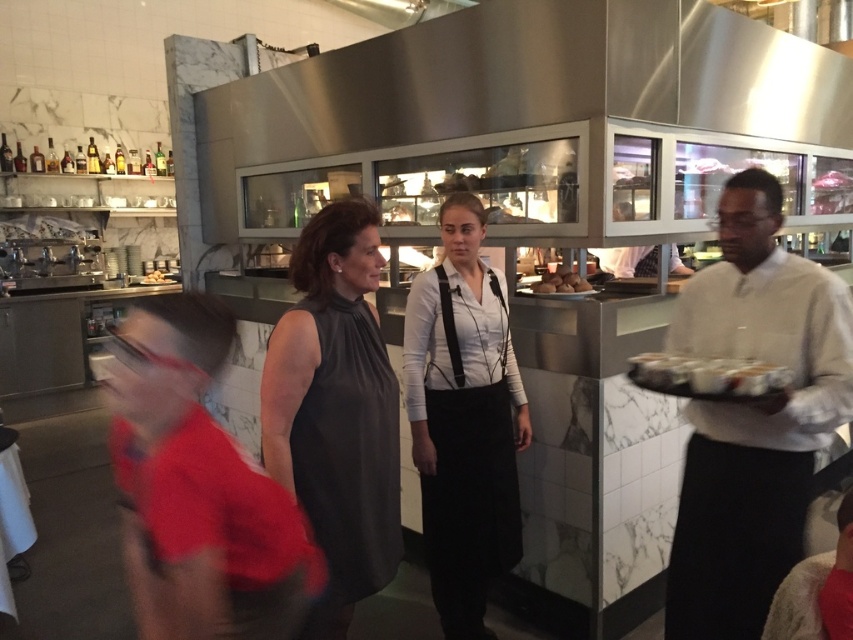
Who is lower down, white matte sweater at right or smooth brown bread at center?

white matte sweater at right is below.

Is white matte sweater at right smaller than smooth brown bread at center?

Incorrect, white matte sweater at right is not smaller in size than smooth brown bread at center.

Measure the distance between point (815,392) and camera.

Point (815,392) is 5.34 feet away from camera.

Find the location of `white matte sweater at right`. white matte sweater at right is located at coordinates (752, 417).

Between white glossy tray at right and smooth brown bread at center, which one has more height?

smooth brown bread at center is taller.

Does white glossy tray at right appear on the right side of smooth brown bread at center?

Yes, white glossy tray at right is to the right of smooth brown bread at center.

The height and width of the screenshot is (640, 853). Find the location of `white glossy tray at right`. white glossy tray at right is located at coordinates (706, 376).

Does white matte shirt at center have a greater height compared to smooth brown bread at center?

Indeed, white matte shirt at center has a greater height compared to smooth brown bread at center.

Which of these two, white matte shirt at center or smooth brown bread at center, stands taller?

white matte shirt at center is taller.

Where is `white matte shirt at center`? white matte shirt at center is located at coordinates (463, 420).